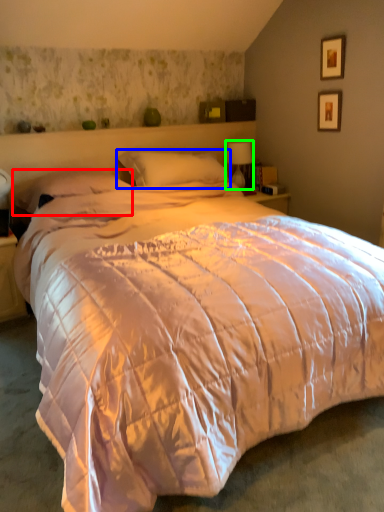
Question: Which is nearer to the pillow (highlighted by a red box)? pillow (highlighted by a blue box) or table lamp (highlighted by a green box).

Choices:
 (A) pillow
 (B) table lamp

Answer: (A)